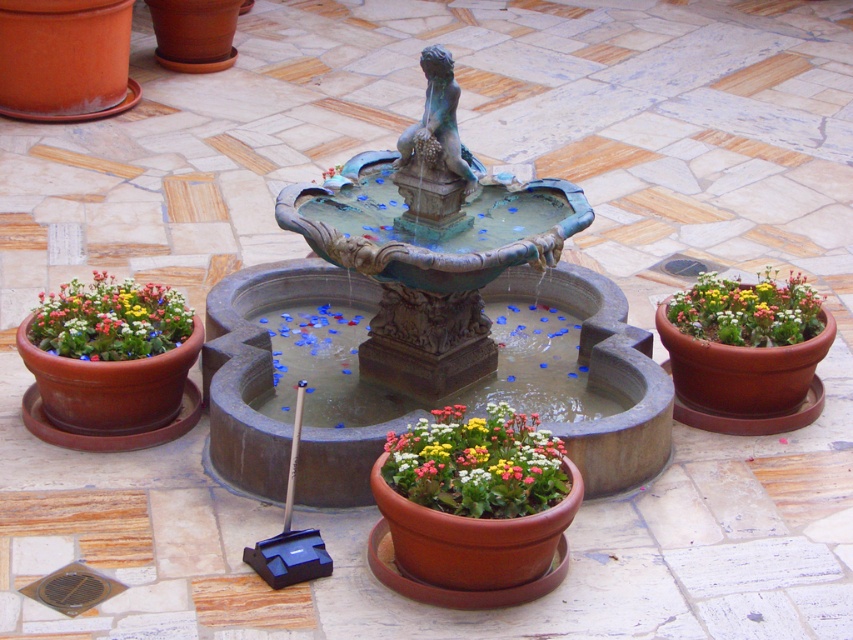
Question: Is matte terracotta pot at center smaller than matte terracotta pot at left?

Choices:
 (A) yes
 (B) no

Answer: (A)

Question: Which object is farther from the camera taking this photo?

Choices:
 (A) matte terracotta pot at center
 (B) matte terracotta pot at left

Answer: (B)

Question: Is green patina fountain at center bigger than matte terracotta pot at center?

Choices:
 (A) yes
 (B) no

Answer: (A)

Question: Which is farther from the matte terracotta pot at center?

Choices:
 (A) matte terracotta pot at left
 (B) green patina fountain at center

Answer: (A)

Question: Which point is closer to the camera?

Choices:
 (A) (479, 442)
 (B) (798, 310)
 (C) (370, 372)

Answer: (A)

Question: Is green patina fountain at center above matte terracotta pot at right?

Choices:
 (A) yes
 (B) no

Answer: (A)